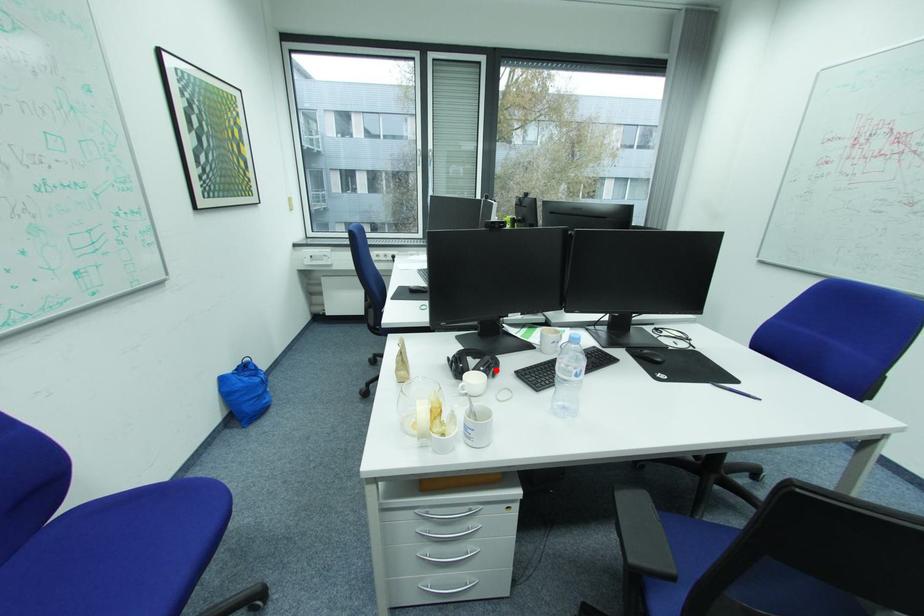
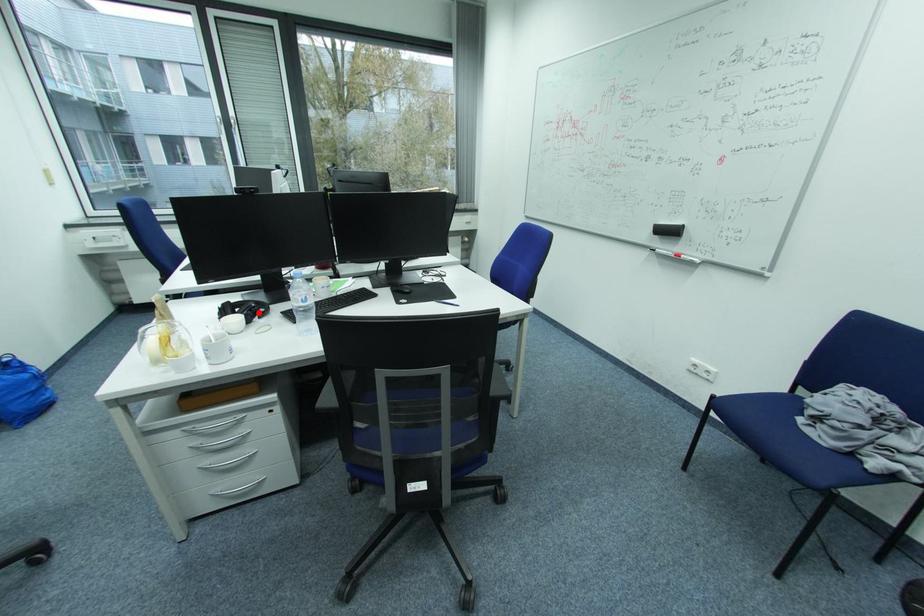
I am providing you with two images of the same scene from different viewpoints. A red point is marked on the first image and another point is marked on the second image. Is the marked point in image1 the same physical position as the marked point in image2?

Yes